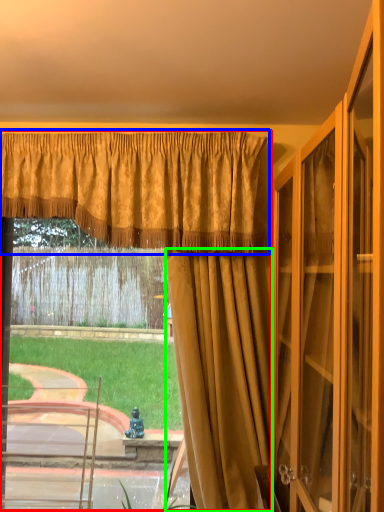
Question: Based on their relative distances, which object is farther from curtain (highlighted by a red box)? Choose from curtain (highlighted by a blue box) and curtain (highlighted by a green box).

Choices:
 (A) curtain
 (B) curtain

Answer: (A)